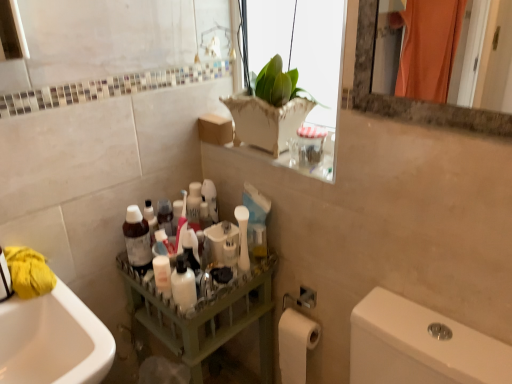
Question: Can you confirm if matte plastic bottle at center is thinner than white glossy bottle at center?

Choices:
 (A) yes
 (B) no

Answer: (B)

Question: Is matte plastic bottle at center looking in the opposite direction of white glossy bottle at center?

Choices:
 (A) yes
 (B) no

Answer: (B)

Question: Are matte plastic bottle at center and white glossy bottle at center located far from each other?

Choices:
 (A) yes
 (B) no

Answer: (B)

Question: Considering the relative sizes of matte plastic bottle at center and white glossy bottle at center in the image provided, is matte plastic bottle at center shorter than white glossy bottle at center?

Choices:
 (A) yes
 (B) no

Answer: (B)

Question: From a real-world perspective, is matte plastic bottle at center over white glossy bottle at center?

Choices:
 (A) no
 (B) yes

Answer: (B)

Question: Looking at the image, does white matte toilet paper at lower right seem bigger or smaller compared to yellow fabric at left?

Choices:
 (A) big
 (B) small

Answer: (A)

Question: In the image, is white matte toilet paper at lower right positioned in front of or behind yellow fabric at left?

Choices:
 (A) front
 (B) behind

Answer: (B)

Question: From the image's perspective, is white matte toilet paper at lower right located above or below yellow fabric at left?

Choices:
 (A) below
 (B) above

Answer: (A)

Question: Is white matte toilet paper at lower right to the left or to the right of yellow fabric at left in the image?

Choices:
 (A) right
 (B) left

Answer: (A)

Question: Visually, is white ceramic vase at upper center positioned to the left or to the right of yellow fabric at left?

Choices:
 (A) right
 (B) left

Answer: (A)

Question: Relative to yellow fabric at left, is white ceramic vase at upper center in front or behind?

Choices:
 (A) front
 (B) behind

Answer: (A)

Question: Looking at their shapes, would you say white ceramic vase at upper center is wider or thinner than yellow fabric at left?

Choices:
 (A) wide
 (B) thin

Answer: (A)

Question: Which is correct: white ceramic vase at upper center is inside yellow fabric at left, or outside of it?

Choices:
 (A) outside
 (B) inside

Answer: (A)

Question: From a real-world perspective, relative to white matte toothbrush at center, is matte plastic bottle at center vertically above or below?

Choices:
 (A) above
 (B) below

Answer: (B)

Question: From their relative heights in the image, would you say matte plastic bottle at center is taller or shorter than white matte toothbrush at center?

Choices:
 (A) short
 (B) tall

Answer: (B)